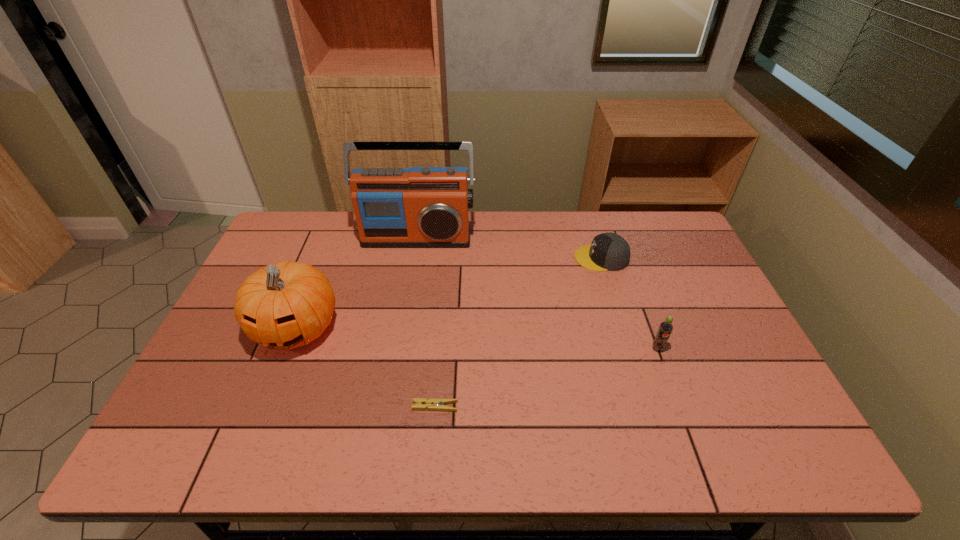
At what (x,y) coordinates should I click in order to perform the action: click on free space that is in between the tallest object and the third tallest object. Please return your answer as a coordinate pair (x, y). Looking at the image, I should click on tap(537, 293).

Locate an element on the screen. The image size is (960, 540). vacant point located between the nearest object and the fourth tallest object is located at coordinates (518, 332).

You are a GUI agent. You are given a task and a screenshot of the screen. Output one action in this format:
    pyautogui.click(x=<x>, y=<y>)
    Task: Click on the vacant area that lies between the radio receiver and the cap
    The width and height of the screenshot is (960, 540).
    Given the screenshot: What is the action you would take?
    pyautogui.click(x=509, y=248)

This screenshot has height=540, width=960. In order to click on vacant area between the clothespin and the tallest object in this screenshot , I will do `click(426, 322)`.

Where is `free space between the second shortest object and the third shortest object`? free space between the second shortest object and the third shortest object is located at coordinates (630, 303).

Identify the location of unoccupied area between the nearest object and the second tallest object. This screenshot has width=960, height=540. (366, 367).

You are a GUI agent. You are given a task and a screenshot of the screen. Output one action in this format:
    pyautogui.click(x=<x>, y=<y>)
    Task: Click on the free space between the third tallest object and the second tallest object
    Image resolution: width=960 pixels, height=540 pixels.
    Given the screenshot: What is the action you would take?
    pyautogui.click(x=477, y=338)

At what (x,y) coordinates should I click in order to perform the action: click on empty location between the cap and the fourth shortest object. Please return your answer as a coordinate pair (x, y). This screenshot has height=540, width=960. Looking at the image, I should click on (449, 293).

Image resolution: width=960 pixels, height=540 pixels. In order to click on vacant space that's between the cap and the second tallest object in this screenshot , I will do `click(449, 293)`.

The height and width of the screenshot is (540, 960). In order to click on vacant region between the tallest object and the third tallest object in this screenshot , I will do `click(537, 293)`.